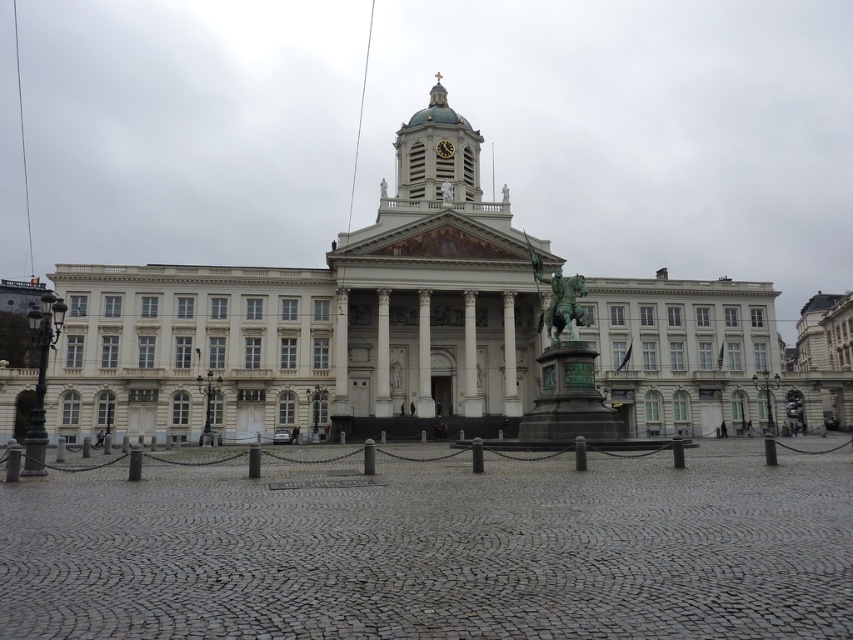
The width and height of the screenshot is (853, 640). What do you see at coordinates (306, 332) in the screenshot?
I see `white marble palace at center` at bounding box center [306, 332].

Based on the photo, can you confirm if white marble palace at center is positioned to the right of gold metallic clock at center?

Correct, you'll find white marble palace at center to the right of gold metallic clock at center.

Between point (483, 250) and point (450, 150), which one is positioned in front?

Point (483, 250) is more forward.

This screenshot has height=640, width=853. I want to click on white marble palace at center, so click(306, 332).

Does bronze statue at center appear on the right side of gold metallic clock at center?

Correct, you'll find bronze statue at center to the right of gold metallic clock at center.

Is point (579, 308) farther from viewer compared to point (442, 156)?

No, (579, 308) is closer to viewer.

The image size is (853, 640). Identify the location of bronze statue at center. (560, 300).

Can you confirm if white marble tower at center is thinner than bronze statue at center?

No, white marble tower at center is not thinner than bronze statue at center.

Does white marble tower at center have a larger size compared to bronze statue at center?

Indeed, white marble tower at center has a larger size compared to bronze statue at center.

Describe the element at coordinates (433, 289) in the screenshot. Image resolution: width=853 pixels, height=640 pixels. I see `white marble tower at center` at that location.

Where is `white marble tower at center`? white marble tower at center is located at coordinates (433, 289).